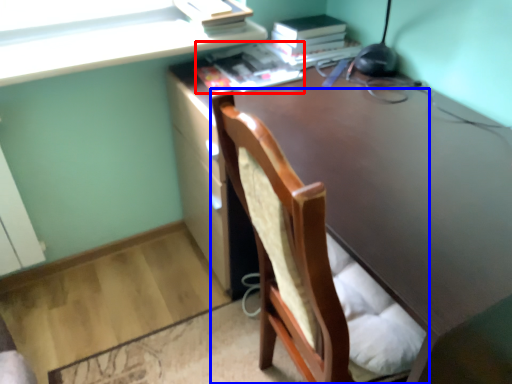
Question: Which of the following is the farthest to the observer, book (highlighted by a red box) or chair (highlighted by a blue box)?

Choices:
 (A) book
 (B) chair

Answer: (A)